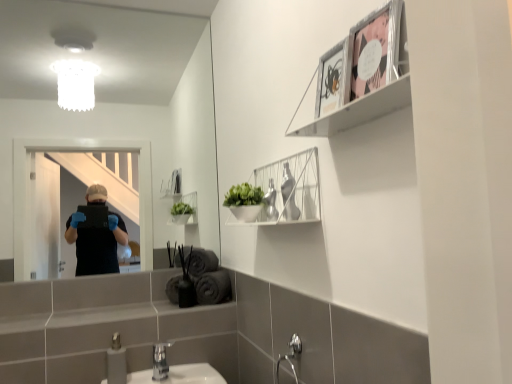
Question: Does metallic silver picture frame at upper right, the 2th picture frame when ordered from right to left, have a greater width compared to silver metallic faucet at lower center?

Choices:
 (A) no
 (B) yes

Answer: (A)

Question: Can you confirm if metallic silver picture frame at upper right, the 2th picture frame when ordered from right to left, is thinner than silver metallic faucet at lower center?

Choices:
 (A) yes
 (B) no

Answer: (A)

Question: Is metallic silver picture frame at upper right, the 2th picture frame when ordered from right to left, located outside silver metallic faucet at lower center?

Choices:
 (A) yes
 (B) no

Answer: (A)

Question: Does metallic silver picture frame at upper right, the 2th picture frame when ordered from right to left, come behind silver metallic faucet at lower center?

Choices:
 (A) yes
 (B) no

Answer: (B)

Question: Is there a large distance between metallic silver picture frame at upper right, arranged as the first picture frame when viewed from the left, and silver metallic faucet at lower center?

Choices:
 (A) yes
 (B) no

Answer: (A)

Question: Considering their positions, is metallic silver picture frame at upper right, arranged as the first picture frame when viewed from the left, located in front of or behind clear glass mirror at upper center?

Choices:
 (A) behind
 (B) front

Answer: (B)

Question: Considering the positions of point (340, 56) and point (45, 137), is point (340, 56) closer or farther from the camera than point (45, 137)?

Choices:
 (A) farther
 (B) closer

Answer: (B)

Question: Is metallic silver picture frame at upper right, the 2th picture frame when ordered from right to left, to the left or to the right of clear glass mirror at upper center in the image?

Choices:
 (A) right
 (B) left

Answer: (A)

Question: Is metallic silver picture frame at upper right, the 2th picture frame when ordered from right to left, situated inside clear glass mirror at upper center or outside?

Choices:
 (A) outside
 (B) inside

Answer: (A)

Question: Considering the positions of pink paper picture frame at upper right, the 2th picture frame in the left-to-right sequence, and metallic silver frame at upper right, the 2th cabinet in the back-to-front sequence, in the image, is pink paper picture frame at upper right, the 2th picture frame in the left-to-right sequence, taller or shorter than metallic silver frame at upper right, the 2th cabinet in the back-to-front sequence,?

Choices:
 (A) tall
 (B) short

Answer: (B)

Question: From the image's perspective, is pink paper picture frame at upper right, the 2th picture frame in the left-to-right sequence, located above or below metallic silver frame at upper right, which is counted as the first cabinet, starting from the top?

Choices:
 (A) below
 (B) above

Answer: (B)

Question: Considering the positions of point (388, 21) and point (349, 64), is point (388, 21) closer or farther from the camera than point (349, 64)?

Choices:
 (A) closer
 (B) farther

Answer: (A)

Question: Considering the positions of pink paper picture frame at upper right, acting as the 1th picture frame starting from the right, and metallic silver frame at upper right, the 2th cabinet ordered from the bottom, in the image, is pink paper picture frame at upper right, acting as the 1th picture frame starting from the right, wider or thinner than metallic silver frame at upper right, the 2th cabinet ordered from the bottom,?

Choices:
 (A) wide
 (B) thin

Answer: (B)

Question: From a real-world perspective, is brushed metal faucet at lower center physically located above or below silver metallic faucet at lower center?

Choices:
 (A) above
 (B) below

Answer: (A)

Question: Is brushed metal faucet at lower center bigger or smaller than silver metallic faucet at lower center?

Choices:
 (A) small
 (B) big

Answer: (B)